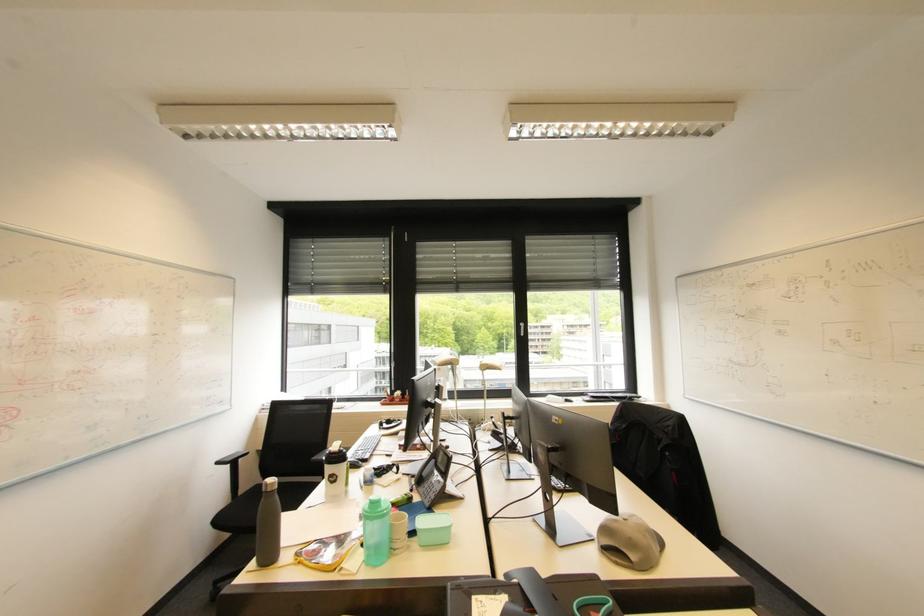
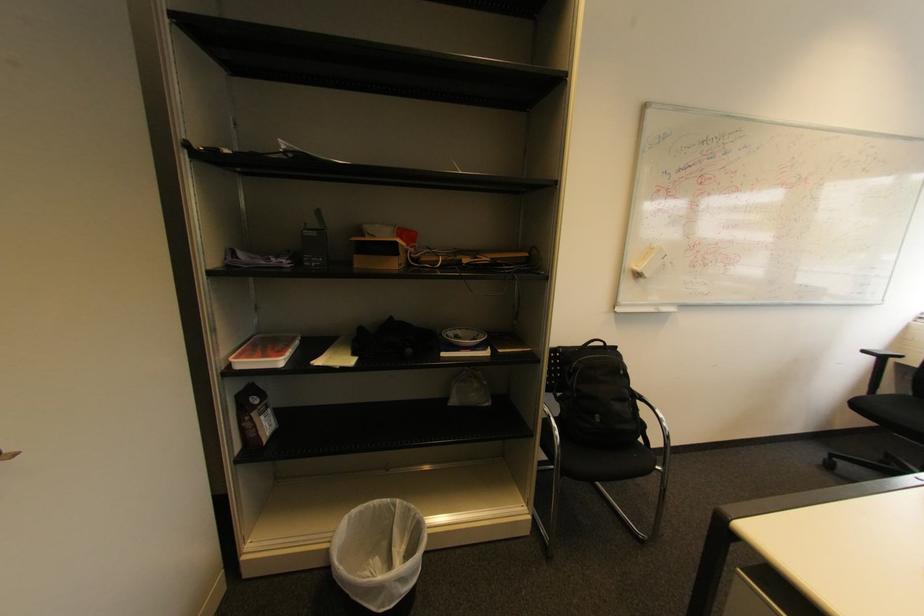
The point at (223, 464) is marked in the first image. Where is the corresponding point in the second image?

(869, 352)